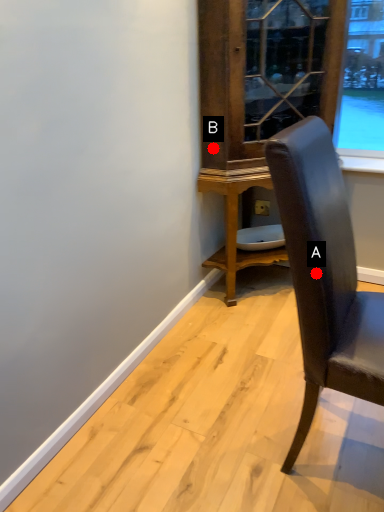
Question: Two points are circled on the image, labeled by A and B beside each circle. Among these points, which one is farthest from the camera?

Choices:
 (A) A is further
 (B) B is further

Answer: (B)